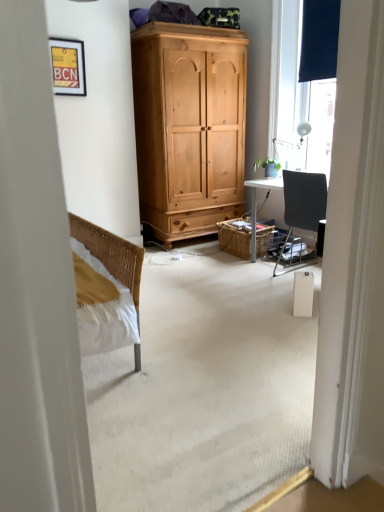
Question: From the image's perspective, relative to matte black window at upper right, is matte yellow picture frame at upper left above or below?

Choices:
 (A) above
 (B) below

Answer: (A)

Question: Considering the positions of point (61, 92) and point (284, 125), is point (61, 92) closer or farther from the camera than point (284, 125)?

Choices:
 (A) farther
 (B) closer

Answer: (B)

Question: Which is farther from the matte yellow picture frame at upper left?

Choices:
 (A) green matte plant at right
 (B) matte black window at upper right
 (C) dark matte curtain at upper right
 (D) woven brown picnic basket at center

Answer: (C)

Question: Which object is the closest to the matte black window at upper right?

Choices:
 (A) green matte plant at right
 (B) matte yellow picture frame at upper left
 (C) woven brown picnic basket at center
 (D) dark matte curtain at upper right

Answer: (D)